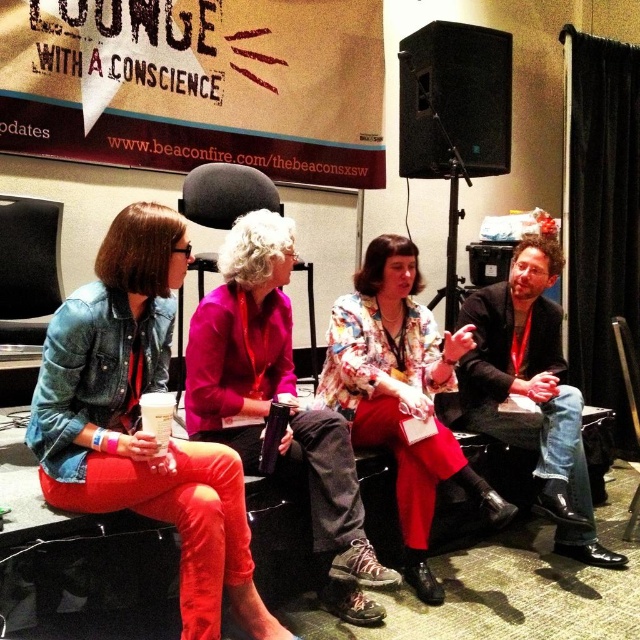
Can you confirm if denim jacket at left is positioned to the left of jeans at right?

Correct, you'll find denim jacket at left to the left of jeans at right.

Is denim jacket at left bigger than jeans at right?

Actually, denim jacket at left might be smaller than jeans at right.

Image resolution: width=640 pixels, height=640 pixels. In order to click on denim jacket at left in this screenshot , I will do `click(140, 422)`.

Can you confirm if denim jacket at left is positioned above black leather chair at center?

No, denim jacket at left is not above black leather chair at center.

Which of these two, denim jacket at left or black leather chair at center, stands taller?

denim jacket at left is taller.

Does point (88, 365) lie behind point (220, 195)?

No, it is in front of (220, 195).

This screenshot has width=640, height=640. In order to click on denim jacket at left in this screenshot , I will do `click(140, 422)`.

Is floral fabric blouse at center wider than jeans at right?

Yes, floral fabric blouse at center is wider than jeans at right.

Is point (397, 486) farther from viewer compared to point (547, 499)?

No, it is in front of (547, 499).

What are the coordinates of `floral fabric blouse at center` in the screenshot? It's located at (401, 394).